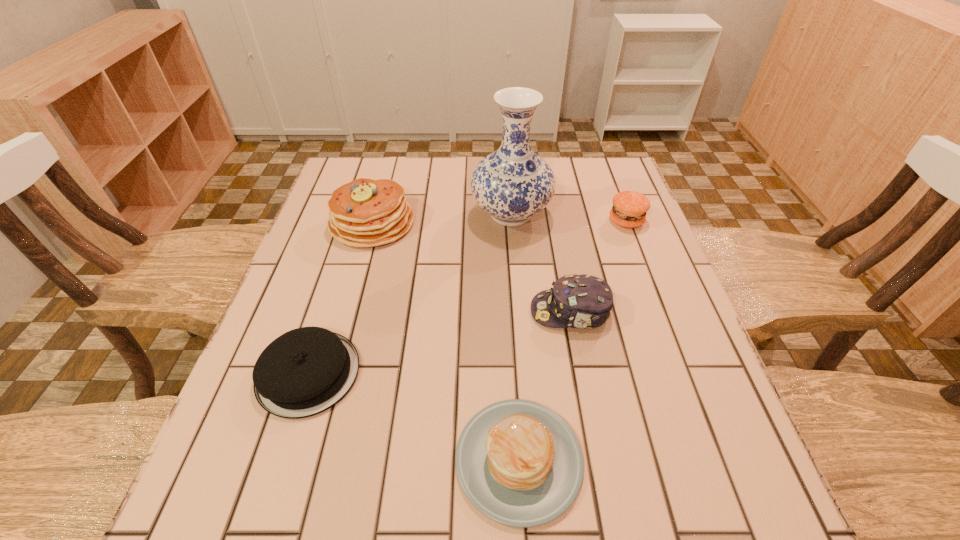
What are the coordinates of `vacant area that lies between the vase and the fifth shortest object` in the screenshot? It's located at (442, 219).

Where is `the fifth closest object to the vase`? the fifth closest object to the vase is located at coordinates (519, 463).

Point out which object is positioned as the third nearest to the farthest pancake. Please provide its 2D coordinates. Your answer should be formatted as a tuple, i.e. [(x, y)], where the tuple contains the x and y coordinates of a point satisfying the conditions above.

[(578, 301)]

Identify which pancake is located as the nearest to the tallest object. Please provide its 2D coordinates. Your answer should be formatted as a tuple, i.e. [(x, y)], where the tuple contains the x and y coordinates of a point satisfying the conditions above.

[(365, 212)]

Select which pancake appears as the third closest to the tallest object. Please provide its 2D coordinates. Your answer should be formatted as a tuple, i.e. [(x, y)], where the tuple contains the x and y coordinates of a point satisfying the conditions above.

[(519, 463)]